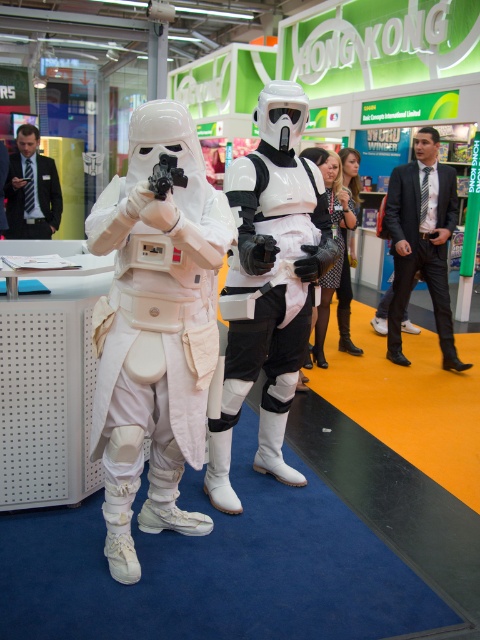
Question: Which point is farther to the camera?

Choices:
 (A) pos(331,280)
 (B) pos(444,164)
 (C) pos(314,266)
 (D) pos(211,189)

Answer: (B)

Question: Is white matte costume at center smaller than dark blue suit at left?

Choices:
 (A) yes
 (B) no

Answer: (B)

Question: Is black suit at right to the left of dark blue suit at left from the viewer's perspective?

Choices:
 (A) yes
 (B) no

Answer: (B)

Question: Is black suit at right to the right of dark blue suit at left from the viewer's perspective?

Choices:
 (A) yes
 (B) no

Answer: (A)

Question: Based on their relative distances, which object is nearer to the black suit at right?

Choices:
 (A) white matte helmet at center
 (B) white matte costume at center

Answer: (A)

Question: Among these objects, which one is farthest from the camera?

Choices:
 (A) white matte costume at center
 (B) white matte helmet at center

Answer: (B)